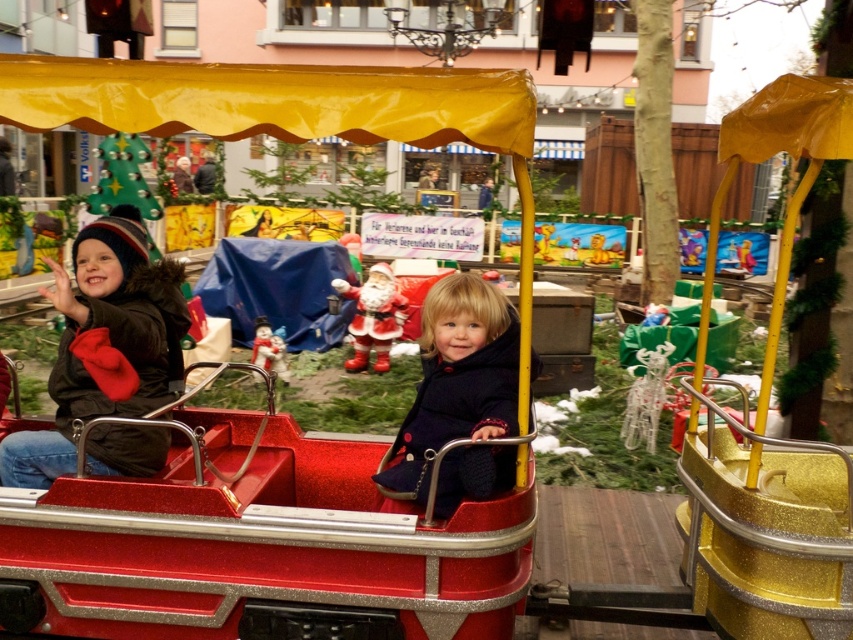
Question: Is shiny red wagon at center to the left of velvet navy coat at center from the viewer's perspective?

Choices:
 (A) yes
 (B) no

Answer: (A)

Question: Estimate the real-world distances between objects in this image. Which object is closer to the matte black jacket at left?

Choices:
 (A) velvet navy coat at center
 (B) shiny red wagon at center

Answer: (B)

Question: From the image, what is the correct spatial relationship of matte black jacket at left in relation to velvet navy coat at center?

Choices:
 (A) above
 (B) below

Answer: (A)

Question: Which object is positioned farthest from the shiny red wagon at center?

Choices:
 (A) matte black jacket at left
 (B) velvet navy coat at center

Answer: (A)

Question: Which of the following is the farthest from the observer?

Choices:
 (A) (421, 497)
 (B) (167, 534)
 (C) (99, 378)

Answer: (A)

Question: Is the position of matte black jacket at left more distant than that of velvet navy coat at center?

Choices:
 (A) no
 (B) yes

Answer: (A)